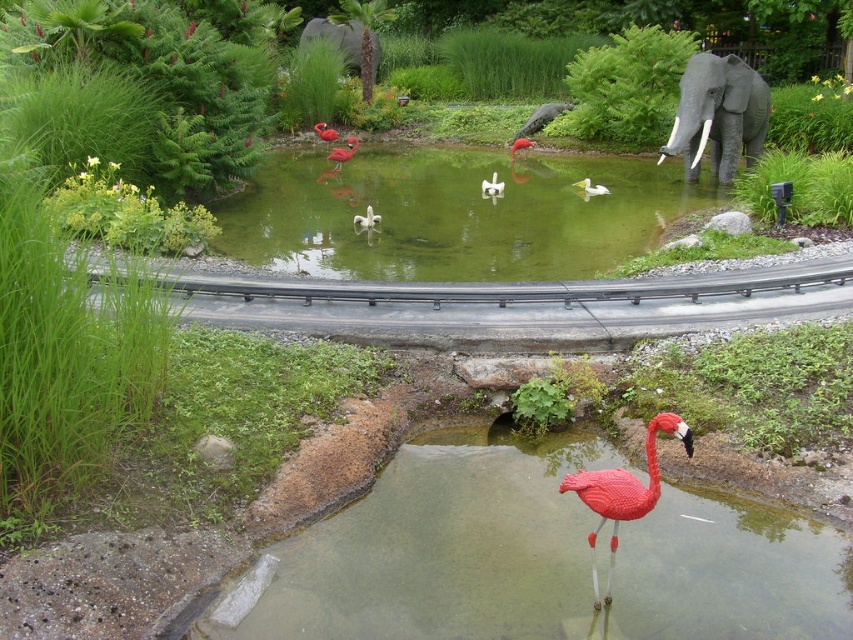
Please provide the 2D coordinates of the green matte water at center in the scene.

The green matte water at center is located at coordinates point (451, 214).

You are a photographer taking a picture of the miniature zoo scene. You notice two points marked in the image. Which point, point (358, 227) or point (573, 184), is closer to your camera lens?

Point (358, 227) is closer to the camera lens than point (573, 184).